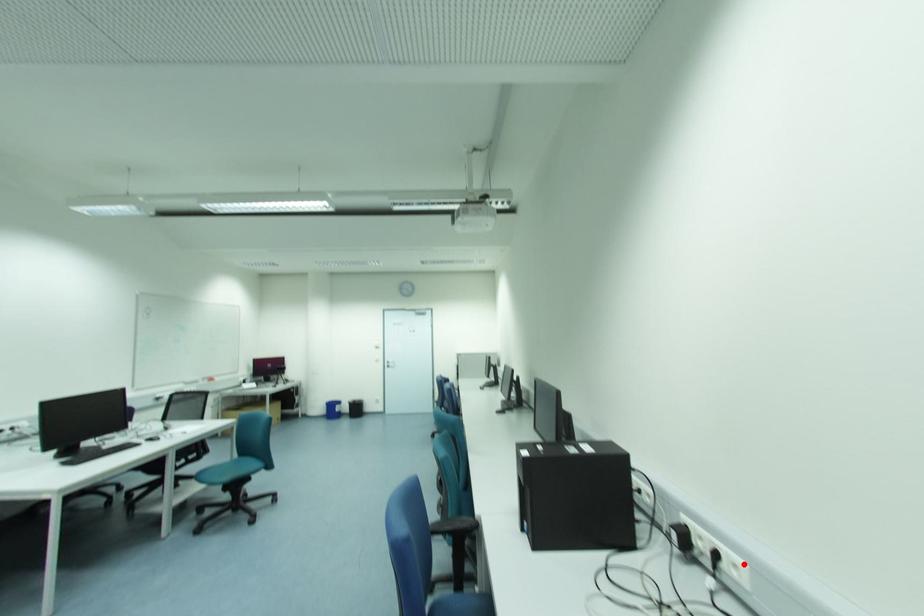
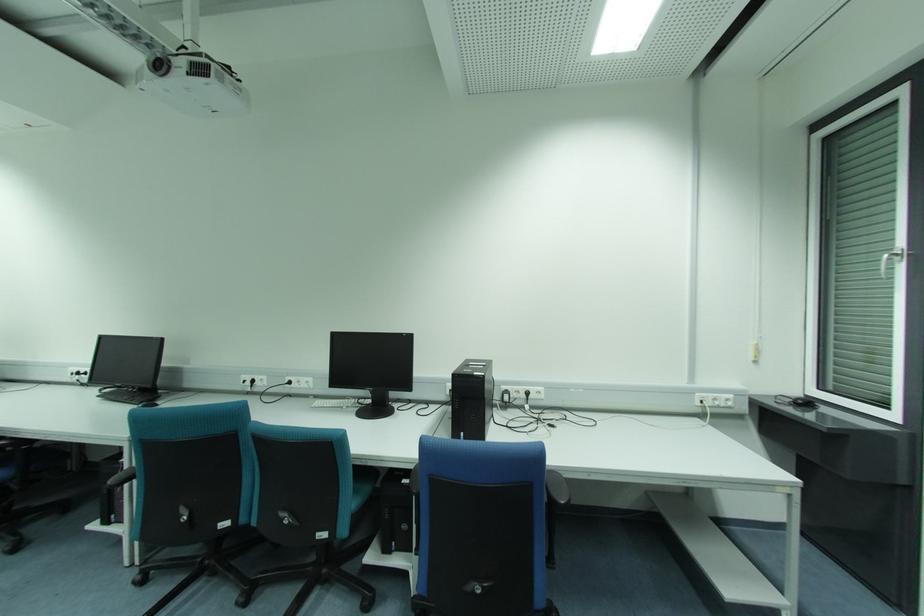
Where in the second image is the point corresponding to the highlighted location from the first image?

(541, 389)